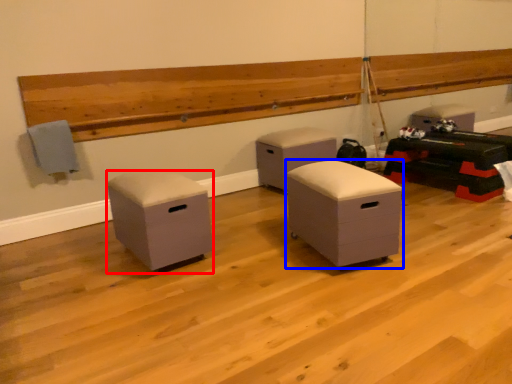
Question: Which object appears farthest to the camera in this image, furniture (highlighted by a red box) or furniture (highlighted by a blue box)?

Choices:
 (A) furniture
 (B) furniture

Answer: (A)